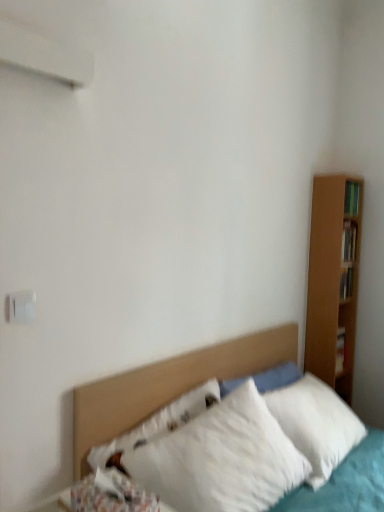
Question: From a real-world perspective, is fluffy white pillow at lower left on white fluffy pillows at center?

Choices:
 (A) no
 (B) yes

Answer: (B)

Question: From a real-world perspective, is fluffy white pillow at lower left positioned under white fluffy pillows at center based on gravity?

Choices:
 (A) yes
 (B) no

Answer: (B)

Question: Could white fluffy pillows at center be considered to be inside fluffy white pillow at lower left?

Choices:
 (A) yes
 (B) no

Answer: (B)

Question: From the image's perspective, is fluffy white pillow at lower left over white fluffy pillows at center?

Choices:
 (A) no
 (B) yes

Answer: (B)

Question: Is fluffy white pillow at lower left positioned beyond the bounds of white fluffy pillows at center?

Choices:
 (A) yes
 (B) no

Answer: (A)

Question: Is fluffy white pillow at lower left wider than white fluffy pillows at center?

Choices:
 (A) no
 (B) yes

Answer: (A)

Question: Is fluffy white pillow at lower left not inside white plastic electric outlet at upper left?

Choices:
 (A) yes
 (B) no

Answer: (A)

Question: Is fluffy white pillow at lower left bigger than white plastic electric outlet at upper left?

Choices:
 (A) no
 (B) yes

Answer: (B)

Question: Does fluffy white pillow at lower left have a greater height compared to white plastic electric outlet at upper left?

Choices:
 (A) no
 (B) yes

Answer: (B)

Question: Is fluffy white pillow at lower left shorter than white plastic electric outlet at upper left?

Choices:
 (A) yes
 (B) no

Answer: (B)

Question: From the image's perspective, is fluffy white pillow at lower left over white plastic electric outlet at upper left?

Choices:
 (A) yes
 (B) no

Answer: (B)

Question: Can you confirm if fluffy white pillow at lower left is smaller than white plastic electric outlet at upper left?

Choices:
 (A) no
 (B) yes

Answer: (A)

Question: Is white fluffy pillows at center not close to white plastic electric outlet at upper left?

Choices:
 (A) no
 (B) yes

Answer: (A)